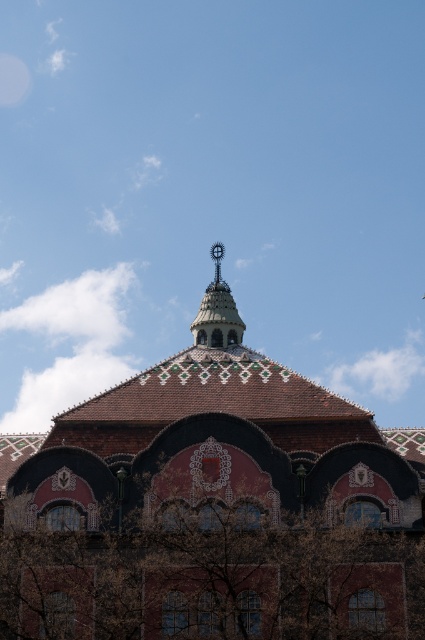
Does reddish-brown tiled roof at center appear on the right side of metallic spire at center?

Correct, you'll find reddish-brown tiled roof at center to the right of metallic spire at center.

In order to click on reddish-brown tiled roof at center in this screenshot , I will do `click(212, 512)`.